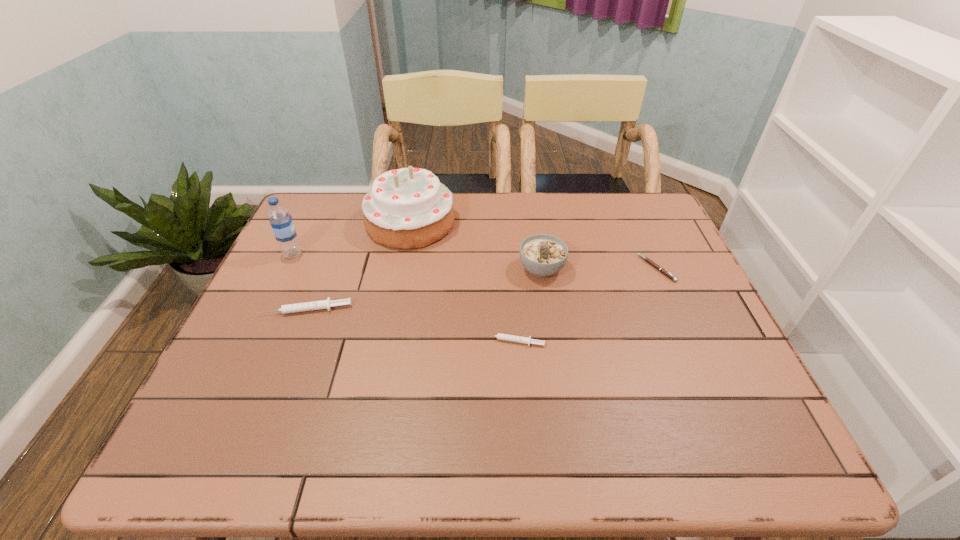
Find the location of `object situated at the right edge`. object situated at the right edge is located at coordinates (669, 275).

The height and width of the screenshot is (540, 960). Identify the location of vacant region at the far edge of the desktop. (501, 225).

Locate an element on the screen. The width and height of the screenshot is (960, 540). free spot at the near edge of the desktop is located at coordinates (288, 384).

The width and height of the screenshot is (960, 540). Identify the location of blank area at the left edge. (x=258, y=361).

In order to click on vacant space at the right edge in this screenshot , I will do `click(697, 291)`.

Image resolution: width=960 pixels, height=540 pixels. I want to click on vacant space at the far left corner of the desktop, so click(314, 194).

Find the location of a particular element. vacant space at the far right corner of the desktop is located at coordinates (625, 212).

The width and height of the screenshot is (960, 540). In order to click on blank region between the water bottle and the fourth tallest object in this screenshot , I will do `click(300, 281)`.

The width and height of the screenshot is (960, 540). Identify the location of vacant space that's between the pen and the left syringe. pos(481,288).

Find the location of a particular element. The height and width of the screenshot is (540, 960). vacant area between the water bottle and the cake is located at coordinates (351, 238).